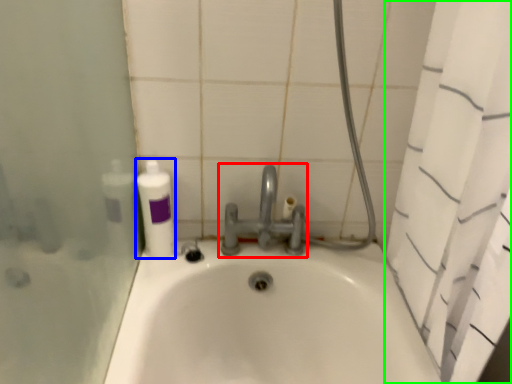
Question: Based on their relative distances, which object is nearer to tap (highlighted by a red box)? Choose from cleaning product (highlighted by a blue box) and shower curtain (highlighted by a green box).

Choices:
 (A) cleaning product
 (B) shower curtain

Answer: (A)